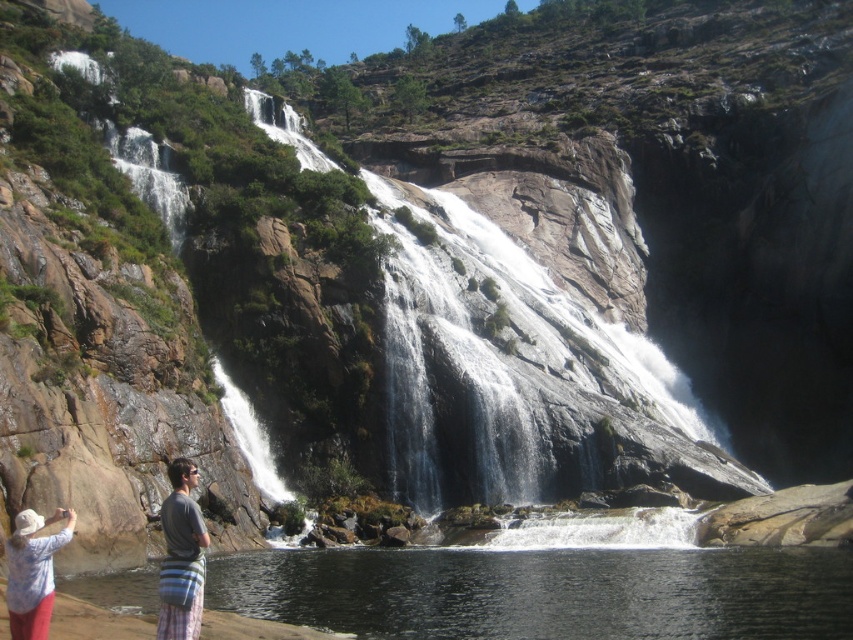
Question: Among these points, which one is nearest to the camera?

Choices:
 (A) (654, 636)
 (B) (45, 621)

Answer: (B)

Question: Estimate the real-world distances between objects in this image. Which object is farther from the gray striped bag at lower left?

Choices:
 (A) clear water at lower left
 (B) white cotton hat at lower left

Answer: (A)

Question: In this image, where is clear water at lower left located relative to white cotton hat at lower left?

Choices:
 (A) right
 (B) left

Answer: (A)

Question: Which object is positioned closest to the gray striped bag at lower left?

Choices:
 (A) clear water at lower left
 (B) white cotton hat at lower left

Answer: (B)

Question: Observing the image, what is the correct spatial positioning of gray striped bag at lower left in reference to white cotton hat at lower left?

Choices:
 (A) left
 (B) right

Answer: (B)

Question: Can you confirm if clear water at lower left is positioned below gray striped bag at lower left?

Choices:
 (A) yes
 (B) no

Answer: (A)